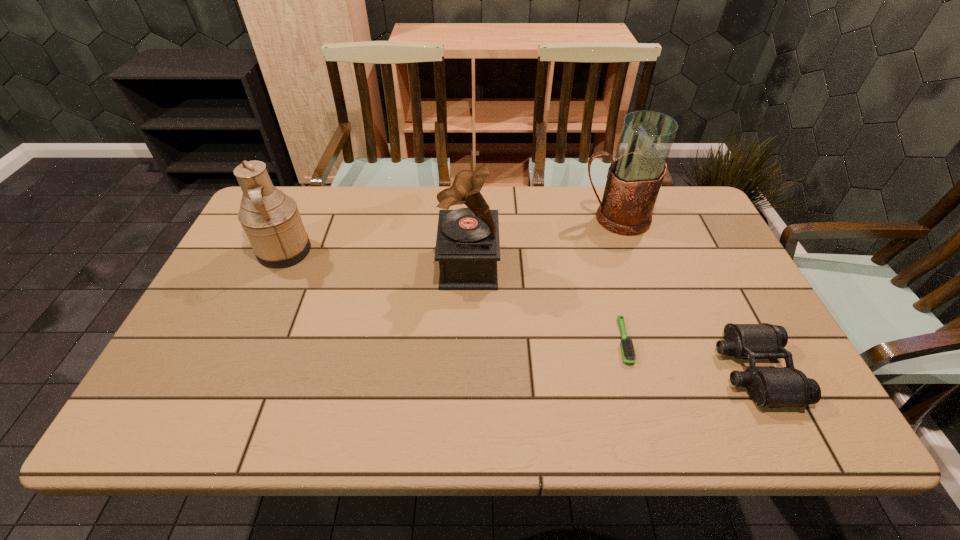
In order to click on the right pitcher in this screenshot , I will do tap(634, 178).

I want to click on the second object from left to right, so click(x=467, y=247).

Where is `the leftmost object`? the leftmost object is located at coordinates (271, 220).

Locate an element on the screen. This screenshot has width=960, height=540. the second shortest object is located at coordinates (768, 387).

At what (x,y) coordinates should I click in order to perform the action: click on binoculars. Please return your answer as a coordinate pair (x, y). Image resolution: width=960 pixels, height=540 pixels. Looking at the image, I should click on (768, 387).

Find the location of `the shortest object`. the shortest object is located at coordinates (628, 352).

Identify the location of free space located with the handle on the side of the right pitcher. Image resolution: width=960 pixels, height=540 pixels. (552, 218).

You are a GUI agent. You are given a task and a screenshot of the screen. Output one action in this format:
    pyautogui.click(x=<x>, y=<y>)
    Task: Click on the vacant space located with the handle on the side of the right pitcher
    The width and height of the screenshot is (960, 540).
    Given the screenshot: What is the action you would take?
    pyautogui.click(x=515, y=218)

Identify the location of blank space located with the handle on the side of the right pitcher. The image size is (960, 540). (556, 218).

I want to click on blank space located at the horn opening of the fourth object from right to left, so click(523, 265).